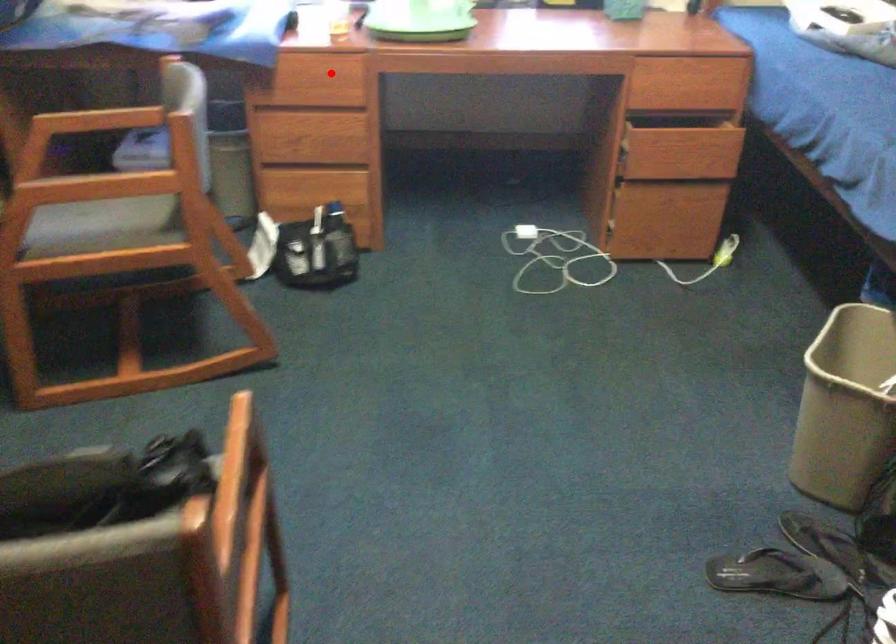
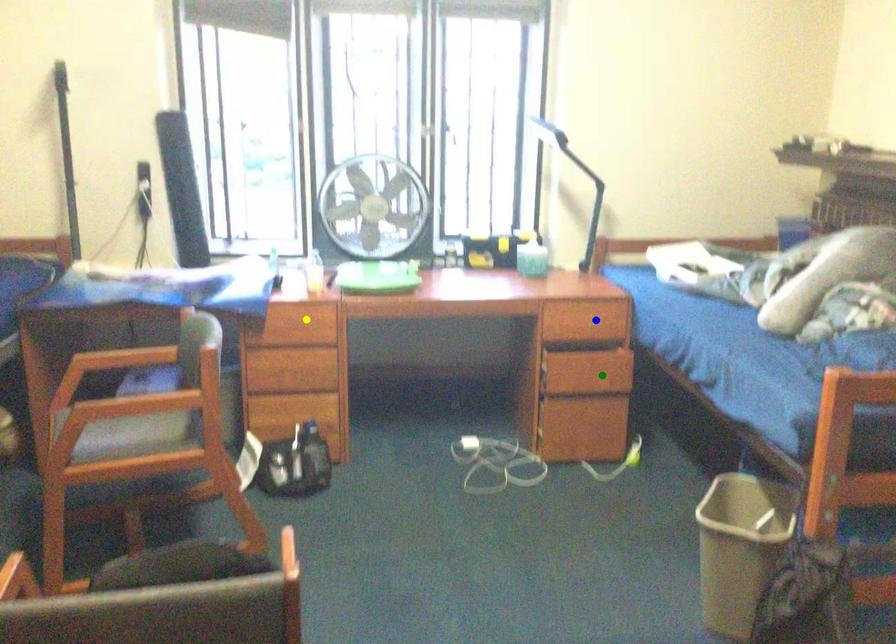
Question: I am providing you with two images of the same scene from different viewpoints. A red point is marked on the first image. You are given multiple points on the second image. Which point in image 2 is actually the same real-world point as the red point in image 1?

Choices:
 (A) green point
 (B) blue point
 (C) yellow point

Answer: (C)